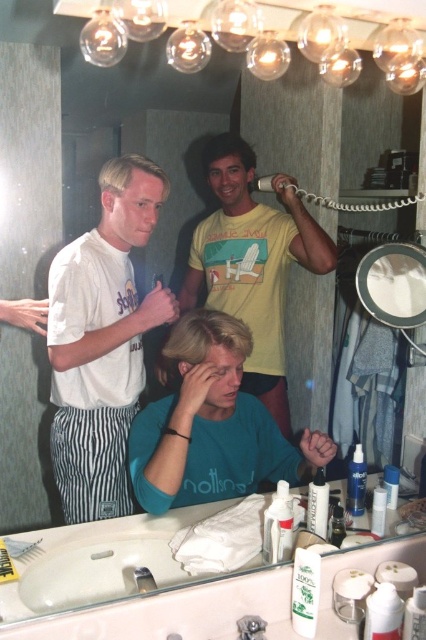
Question: Which point appears closest to the camera in this image?

Choices:
 (A) (109, 170)
 (B) (187, 477)

Answer: (B)

Question: Which object appears closest to the camera in this image?

Choices:
 (A) teal matte shirt at center
 (B) white cotton shirt at center
 (C) white glossy sink at lower center
 (D) yellow cotton shirt at upper center

Answer: (C)

Question: Can you confirm if white cotton shirt at center is thinner than yellow cotton shirt at upper center?

Choices:
 (A) yes
 (B) no

Answer: (A)

Question: Which of these objects is positioned farthest from the blonde hair at upper left?

Choices:
 (A) blonde hair at center
 (B) yellow cotton shirt at upper center
 (C) teal matte shirt at center

Answer: (C)

Question: Observing the image, what is the correct spatial positioning of blonde hair at center in reference to dark brown hair at upper center?

Choices:
 (A) right
 (B) left

Answer: (B)

Question: Can you confirm if yellow cotton shirt at upper center is smaller than white glossy sink at lower center?

Choices:
 (A) yes
 (B) no

Answer: (B)